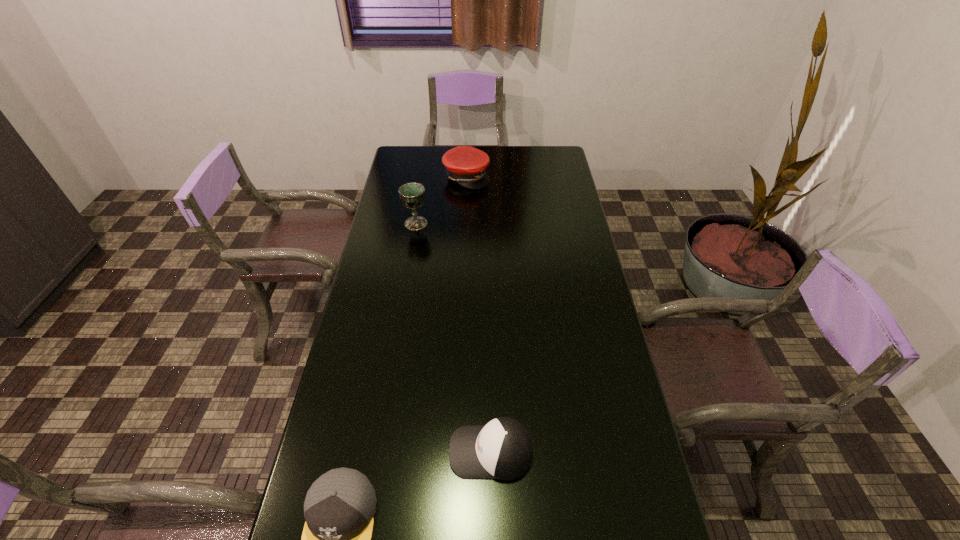
In the image, there is a desktop. At what (x,y) coordinates should I click in order to perform the action: click on vacant space at the far right corner. Please return your answer as a coordinate pair (x, y). Looking at the image, I should click on (546, 148).

Identify the location of free space between the tallest object and the farthest cap. This screenshot has height=540, width=960. (442, 200).

At what (x,y) coordinates should I click in order to perform the action: click on object that ranks as the second closest to the tallest object. Please return your answer as a coordinate pair (x, y). This screenshot has height=540, width=960. Looking at the image, I should click on (502, 449).

This screenshot has height=540, width=960. Identify the location of object that is the nearest to the leftmost cap. (502, 449).

Point out which cap is positioned as the second nearest to the chalice. Please provide its 2D coordinates. Your answer should be formatted as a tuple, i.e. [(x, y)], where the tuple contains the x and y coordinates of a point satisfying the conditions above.

[(502, 449)]

Select which cap is the third closest to the third nearest object. Please provide its 2D coordinates. Your answer should be formatted as a tuple, i.e. [(x, y)], where the tuple contains the x and y coordinates of a point satisfying the conditions above.

[(339, 507)]

You are a GUI agent. You are given a task and a screenshot of the screen. Output one action in this format:
    pyautogui.click(x=<x>, y=<y>)
    Task: Click on the vacant area in the image that satisfies the following two spatial constraints: 1. on the front-facing side of the farthest cap; 2. on the front side of the third nearest object
    This screenshot has height=540, width=960.
    Given the screenshot: What is the action you would take?
    pyautogui.click(x=465, y=224)